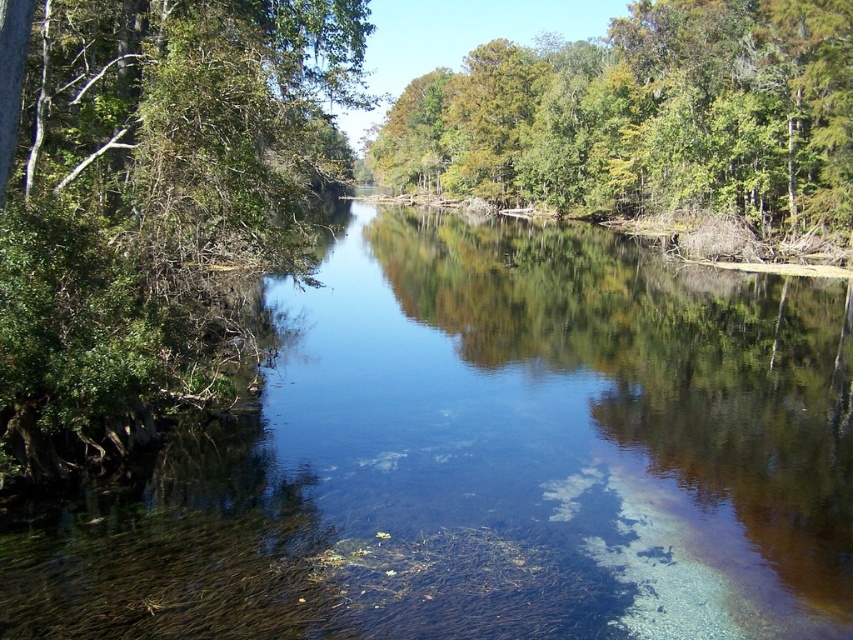
You are a kayaker planning to paddle along the river. You see the clear water at center and the green leafy tree at left. Which object is closer to the starting point of the river?

The green leafy tree at left is closer to the starting point of the river because the clear water at center is located below it, indicating the tree is upstream.

You are standing on the riverbank and want to cross the river to the other side. You see a point marked at coordinates point (490, 458). What is the condition of the water at that point?

The point (490, 458) corresponds to clear water at center, so the water at that point is clear and suitable for crossing.